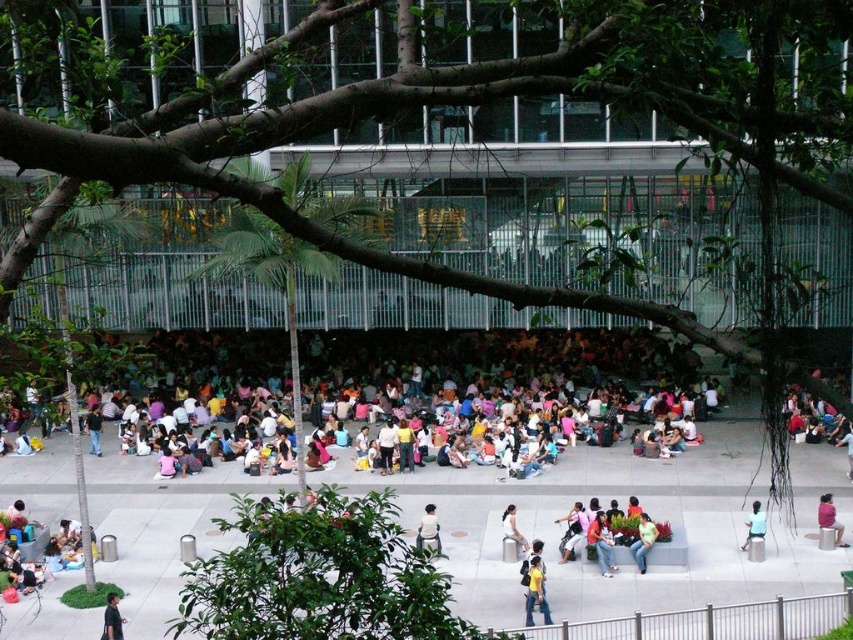
You are standing in the plaza and see two points marked on the ground. The first point is at coordinate point [437,540] and the second is at point [521,544]. Which point is closer to you?

Point [437,540] is closer to you because it is further to the camera than point [521,544].

You are a food vendor with a cart that requires a 3 meter space to set up. You see the green fabric person at lower right and the light brown leather jacket at center. Is there enough space between them to set up your cart?

The distance between the green fabric person at lower right and the light brown leather jacket at center is 3.25 meters, which is sufficient for your 3 meter space requirement. You can set up your cart there.

You are a photographer standing in the plaza and want to capture both the green leafy tree at center and the white fabric shirt at center in a single frame. Given their sizes, which object should you focus on to ensure both are clearly visible in your photo?

The green leafy tree at center is larger than the white fabric shirt at center, so focusing on the tree will help ensure both are visible as the tree occupies more space in the frame.